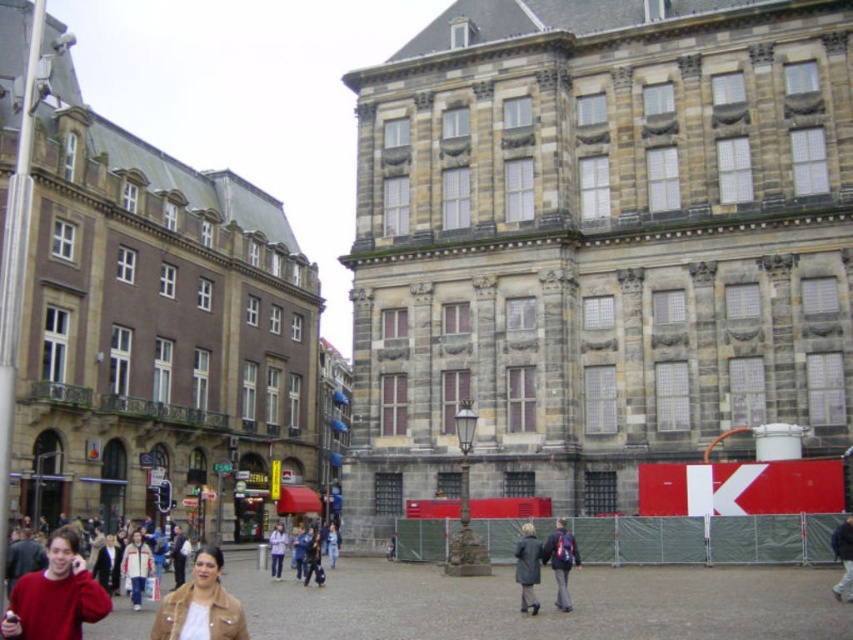
Question: Which object is positioned farthest from the matte red sweater at lower left?

Choices:
 (A) light purple jacket at center
 (B) dark gray jacket at center
 (C) dark gray coat at center
 (D) brown leather jacket at lower left

Answer: (A)

Question: Is matte red sweater at lower left further to the viewer compared to light purple jacket at center?

Choices:
 (A) yes
 (B) no

Answer: (B)

Question: Which point is closer to the camera?

Choices:
 (A) (521, 541)
 (B) (277, 531)

Answer: (A)

Question: Is dark gray coat at center below dark blue jacket at center?

Choices:
 (A) no
 (B) yes

Answer: (B)

Question: Can you confirm if dark gray jacket at center is positioned to the left of dark blue jacket at center?

Choices:
 (A) no
 (B) yes

Answer: (B)

Question: Which point is farther from the camera taking this photo?

Choices:
 (A) click(x=846, y=570)
 (B) click(x=221, y=604)

Answer: (A)